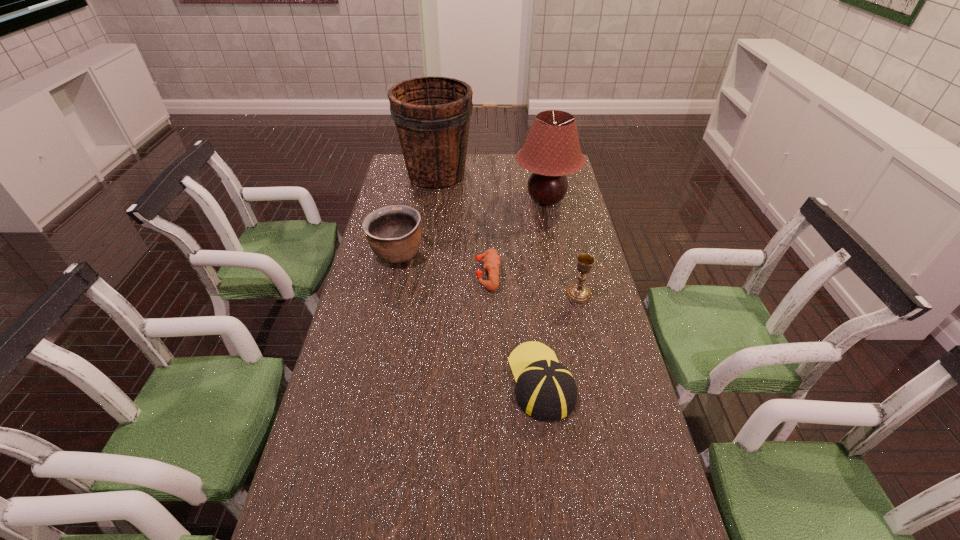
This screenshot has height=540, width=960. In order to click on pottery located at the left edge in this screenshot , I will do `click(393, 232)`.

The width and height of the screenshot is (960, 540). What are the coordinates of `lampshade located at the right edge` in the screenshot? It's located at (551, 151).

This screenshot has width=960, height=540. Identify the location of chalice positioned at the right edge. (579, 293).

Image resolution: width=960 pixels, height=540 pixels. In order to click on baseball cap at the right edge in this screenshot , I will do `click(545, 390)`.

Where is `object that is positioned at the far left corner`? The height and width of the screenshot is (540, 960). object that is positioned at the far left corner is located at coordinates (432, 115).

The image size is (960, 540). In order to click on free location at the left edge in this screenshot , I will do `click(359, 401)`.

You are a GUI agent. You are given a task and a screenshot of the screen. Output one action in this format:
    pyautogui.click(x=<x>, y=<y>)
    Task: Click on the blank space at the right edge of the desktop
    The height and width of the screenshot is (540, 960).
    Given the screenshot: What is the action you would take?
    pyautogui.click(x=630, y=413)

Find the location of `vacant area that lies between the lampshade and the chalice`. vacant area that lies between the lampshade and the chalice is located at coordinates (563, 247).

The height and width of the screenshot is (540, 960). In order to click on free space between the fourth object from right to left and the bucket in this screenshot , I will do `click(462, 224)`.

Locate an element on the screen. This screenshot has height=540, width=960. free point between the fourth object from right to left and the pottery is located at coordinates (443, 264).